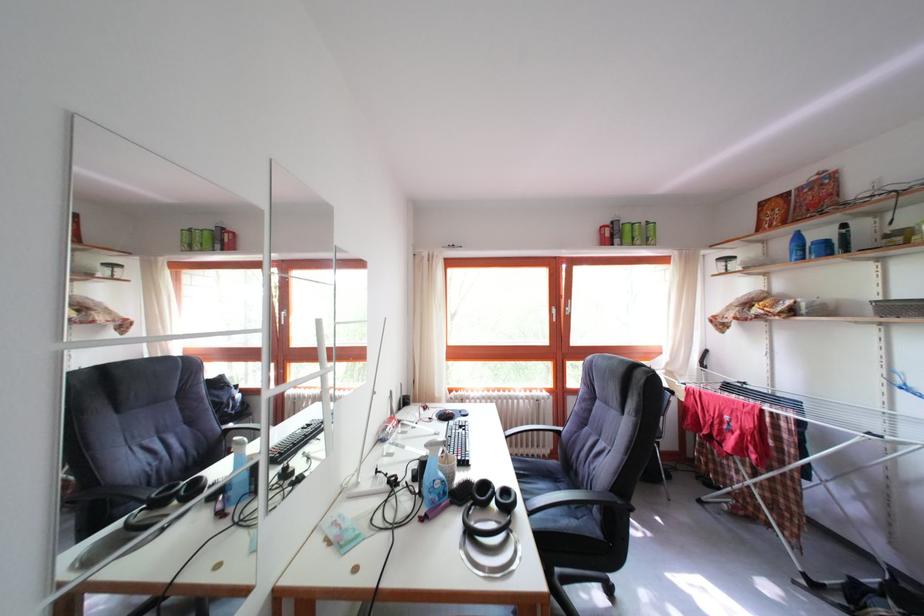
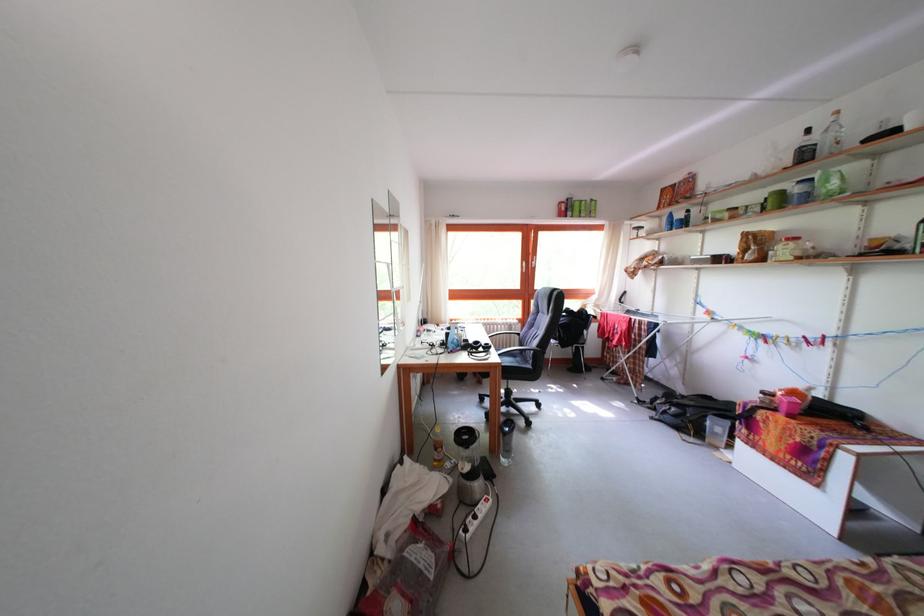
Find the pixel in the second image that matches (503,499) in the first image.

(489, 352)